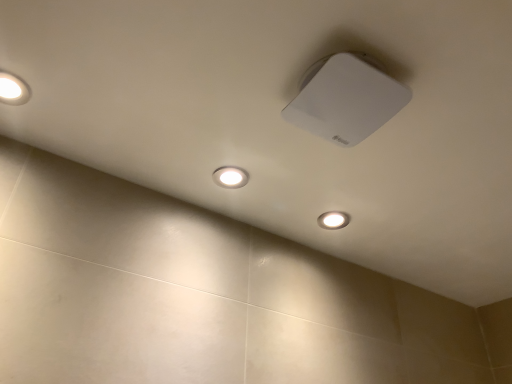
I want to click on matte white light at lower center, so click(333, 220).

What do you see at coordinates (333, 220) in the screenshot? This screenshot has width=512, height=384. I see `matte white light at lower center` at bounding box center [333, 220].

You are a GUI agent. You are given a task and a screenshot of the screen. Output one action in this format:
    pyautogui.click(x=<x>, y=<y>)
    Task: Click on the white matte square at upper center, positioned as the 2th lamp in left-to-right order
    
    Given the screenshot: What is the action you would take?
    pyautogui.click(x=346, y=98)

The height and width of the screenshot is (384, 512). What do you see at coordinates (13, 89) in the screenshot?
I see `matte white light at upper left, the second lamp viewed from the right` at bounding box center [13, 89].

This screenshot has height=384, width=512. In order to click on matte white light at lower center in this screenshot , I will do `click(333, 220)`.

What's the angular difference between matte white light at lower center and matte white light at upper left, the first lamp in the left-to-right sequence,'s facing directions?

0.00191 degrees separate the facing orientations of matte white light at lower center and matte white light at upper left, the first lamp in the left-to-right sequence.

Locate an element on the screen. lamp above the matte white light at lower center (from a real-world perspective) is located at coordinates (13, 89).

Considering the positions of objects matte white light at lower center and matte white light at upper left, the first lamp in the left-to-right sequence, in the image provided, who is in front, matte white light at lower center or matte white light at upper left, the first lamp in the left-to-right sequence,?

matte white light at upper left, the first lamp in the left-to-right sequence, is closer to the camera.

Is there a large distance between matte white light at lower center and matte white light at upper left, the second lamp viewed from the right?

Actually, matte white light at lower center and matte white light at upper left, the second lamp viewed from the right, are a little close together.

Between white matte square at upper center, positioned as the 2th lamp in left-to-right order, and matte white light at lower center, which one has less height?

With less height is matte white light at lower center.

Considering the positions of objects white matte square at upper center, positioned as the 2th lamp in left-to-right order, and matte white light at lower center in the image provided, who is more to the right, white matte square at upper center, positioned as the 2th lamp in left-to-right order, or matte white light at lower center?

matte white light at lower center is more to the right.

Is white matte square at upper center, positioned as the 2th lamp in left-to-right order, inside the boundaries of matte white light at lower center, or outside?

white matte square at upper center, positioned as the 2th lamp in left-to-right order, exists outside the volume of matte white light at lower center.

Is white matte square at upper center, positioned as the 2th lamp in left-to-right order, situated inside matte white light at upper left, the first lamp in the left-to-right sequence, or outside?

white matte square at upper center, positioned as the 2th lamp in left-to-right order, exists outside the volume of matte white light at upper left, the first lamp in the left-to-right sequence.

Is white matte square at upper center, which is counted as the first lamp, starting from the right, facing away from matte white light at upper left, the first lamp in the left-to-right sequence?

white matte square at upper center, which is counted as the first lamp, starting from the right, does not have its back to matte white light at upper left, the first lamp in the left-to-right sequence.

This screenshot has height=384, width=512. I want to click on lamp that is in front of the matte white light at upper left, the first lamp in the left-to-right sequence, so click(x=346, y=98).

Does point (322, 98) appear closer or farther from the camera than point (19, 100)?

Point (322, 98).

How different are the orientations of matte white light at upper left, the first lamp in the left-to-right sequence, and matte white light at lower center in degrees?

matte white light at upper left, the first lamp in the left-to-right sequence, and matte white light at lower center are facing 0.00191 degrees away from each other.

From the image's perspective, is matte white light at upper left, the second lamp viewed from the right, above matte white light at lower center?

Yes, from the image's perspective, matte white light at upper left, the second lamp viewed from the right, is on top of matte white light at lower center.

Considering the positions of objects matte white light at upper left, the second lamp viewed from the right, and matte white light at lower center in the image provided, who is in front, matte white light at upper left, the second lamp viewed from the right, or matte white light at lower center?

matte white light at upper left, the second lamp viewed from the right, is more forward.

Considering the relative sizes of matte white light at upper left, the second lamp viewed from the right, and matte white light at lower center in the image provided, is matte white light at upper left, the second lamp viewed from the right, taller than matte white light at lower center?

Yes, matte white light at upper left, the second lamp viewed from the right, is taller than matte white light at lower center.

Is matte white light at lower center at the right side of white matte square at upper center, positioned as the 2th lamp in left-to-right order?

Yes.

How different are the orientations of matte white light at lower center and white matte square at upper center, positioned as the 2th lamp in left-to-right order, in degrees?

They differ by 1.07 degrees in their facing directions.

From a real-world perspective, is matte white light at lower center on top of white matte square at upper center, positioned as the 2th lamp in left-to-right order?

Yes.

Between matte white light at lower center and white matte square at upper center, positioned as the 2th lamp in left-to-right order, which one is positioned in front?

white matte square at upper center, positioned as the 2th lamp in left-to-right order, is in front.

From a real-world perspective, is matte white light at upper left, the second lamp viewed from the right, over white matte square at upper center, which is counted as the first lamp, starting from the right?

Yes.

Does point (4, 100) come farther from viewer compared to point (310, 100)?

Yes.

Is matte white light at upper left, the first lamp in the left-to-right sequence, with white matte square at upper center, positioned as the 2th lamp in left-to-right order?

No.

You are a GUI agent. You are given a task and a screenshot of the screen. Output one action in this format:
    pyautogui.click(x=<x>, y=<y>)
    Task: Click on the lamp that appears below the matte white light at upper left, the first lamp in the left-to-right sequence (from a real-world perspective)
    
    Given the screenshot: What is the action you would take?
    pyautogui.click(x=346, y=98)

The image size is (512, 384). Find the location of `dot located on the right of matte white light at upper left, the first lamp in the left-to-right sequence`. dot located on the right of matte white light at upper left, the first lamp in the left-to-right sequence is located at coordinates (333, 220).

You are a GUI agent. You are given a task and a screenshot of the screen. Output one action in this format:
    pyautogui.click(x=<x>, y=<y>)
    Task: Click on the 2nd lamp in front of the matte white light at lower center
    
    Given the screenshot: What is the action you would take?
    pyautogui.click(x=346, y=98)

Estimate the real-world distances between objects in this image. Which object is closer to white matte square at upper center, positioned as the 2th lamp in left-to-right order, matte white light at lower center or matte white light at upper left, the second lamp viewed from the right?

matte white light at lower center is closer to white matte square at upper center, positioned as the 2th lamp in left-to-right order.

When comparing their distances from matte white light at lower center, does matte white light at upper left, the first lamp in the left-to-right sequence, or white matte square at upper center, which is counted as the first lamp, starting from the right, seem further?

matte white light at upper left, the first lamp in the left-to-right sequence, is further to matte white light at lower center.

From the image, which object appears to be nearer to matte white light at lower center, white matte square at upper center, positioned as the 2th lamp in left-to-right order, or matte white light at upper left, the second lamp viewed from the right?

white matte square at upper center, positioned as the 2th lamp in left-to-right order.

Based on their spatial positions, is matte white light at upper left, the first lamp in the left-to-right sequence, or matte white light at lower center closer to white matte square at upper center, which is counted as the first lamp, starting from the right?

matte white light at lower center is positioned closer to the anchor white matte square at upper center, which is counted as the first lamp, starting from the right.

Estimate the real-world distances between objects in this image. Which object is further from matte white light at upper left, the second lamp viewed from the right, matte white light at lower center or white matte square at upper center, which is counted as the first lamp, starting from the right?

matte white light at lower center lies further to matte white light at upper left, the second lamp viewed from the right, than the other object.

Which object lies further to the anchor point matte white light at upper left, the second lamp viewed from the right, white matte square at upper center, which is counted as the first lamp, starting from the right, or matte white light at lower center?

The object further to matte white light at upper left, the second lamp viewed from the right, is matte white light at lower center.

Where is `lamp between matte white light at upper left, the second lamp viewed from the right, and matte white light at lower center, in the horizontal direction`? The width and height of the screenshot is (512, 384). lamp between matte white light at upper left, the second lamp viewed from the right, and matte white light at lower center, in the horizontal direction is located at coordinates (346, 98).